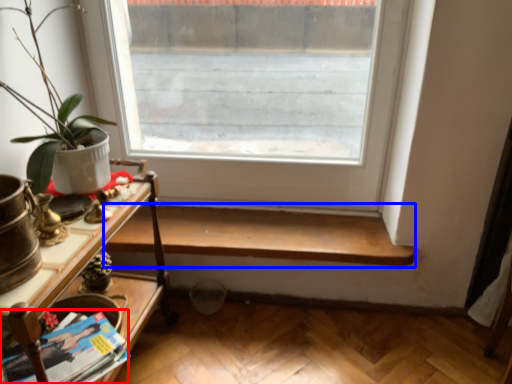
Question: Which object is closer to the camera taking this photo, magazine (highlighted by a red box) or shelf (highlighted by a blue box)?

Choices:
 (A) magazine
 (B) shelf

Answer: (A)